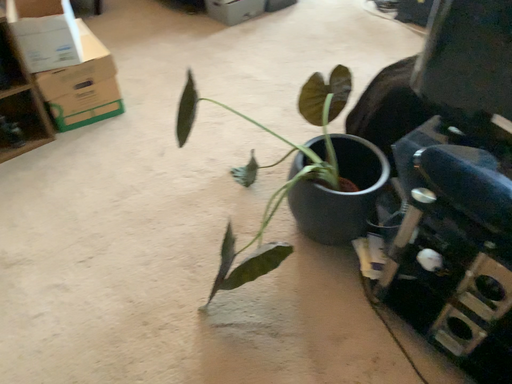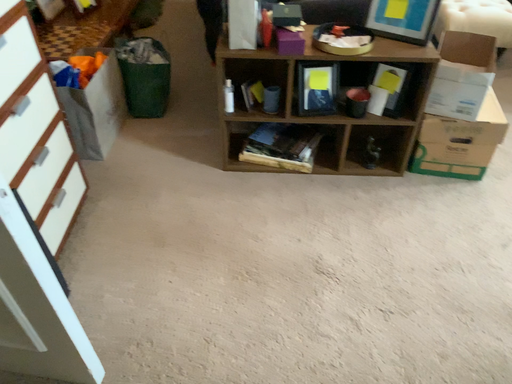
Question: How did the camera likely rotate when shooting the video?

Choices:
 (A) rotated downward
 (B) rotated upward

Answer: (B)